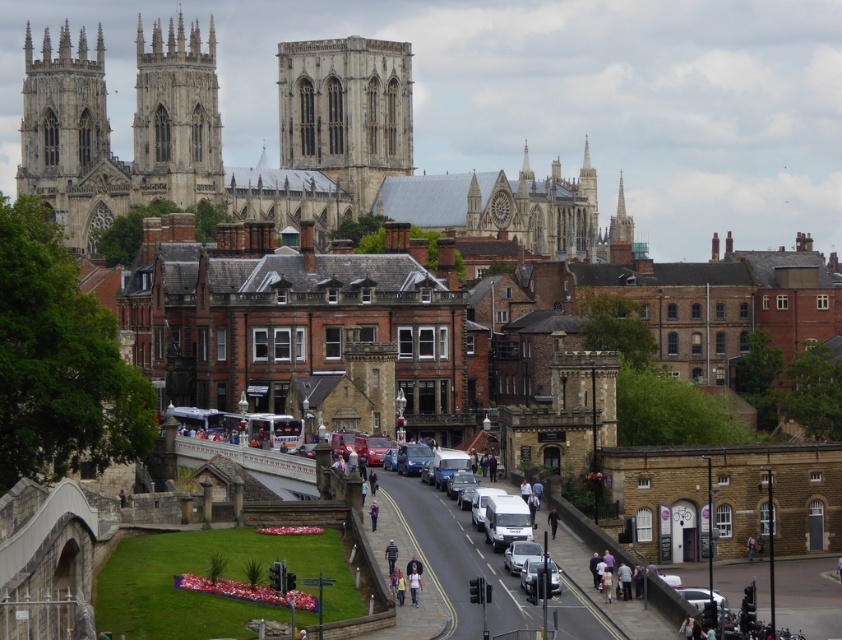
Between metallic silver car at center and purple fabric jacket at center, which one appears on the right side from the viewer's perspective?

From the viewer's perspective, metallic silver car at center appears more on the right side.

In the scene shown: Can you confirm if metallic silver car at center is thinner than purple fabric jacket at center?

No.

Does point (533, 576) come closer to viewer compared to point (370, 520)?

Yes, point (533, 576) is closer to viewer.

Identify the location of metallic silver car at center. (530, 573).

Does metallic silver car at center have a lesser height compared to blue striped shirt at center?

No, metallic silver car at center is not shorter than blue striped shirt at center.

Which is more to the right, metallic silver car at center or blue striped shirt at center?

metallic silver car at center

Is point (525, 568) in front of point (392, 552)?

Yes, it is.

Identify the location of metallic silver car at center. The width and height of the screenshot is (842, 640). (530, 573).

Is stone gothic tower at center bigger than light blue jeans at center?

Indeed, stone gothic tower at center has a larger size compared to light blue jeans at center.

Can you confirm if stone gothic tower at center is thinner than light blue jeans at center?

No, stone gothic tower at center is not thinner than light blue jeans at center.

At what (x,y) coordinates should I click in order to perform the action: click on stone gothic tower at center. Please return your answer as a coordinate pair (x, y). Looking at the image, I should click on (345, 112).